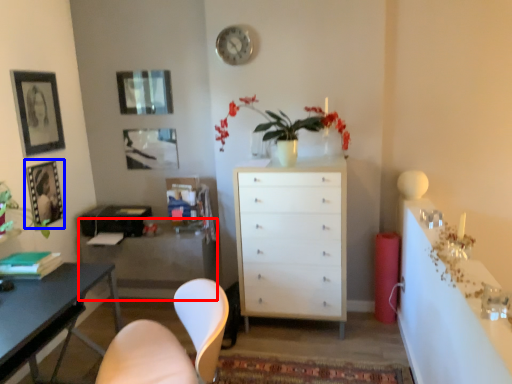
Question: Which point is further to the camera, cabinetry (highlighted by a red box) or picture frame (highlighted by a blue box)?

Choices:
 (A) cabinetry
 (B) picture frame

Answer: (A)